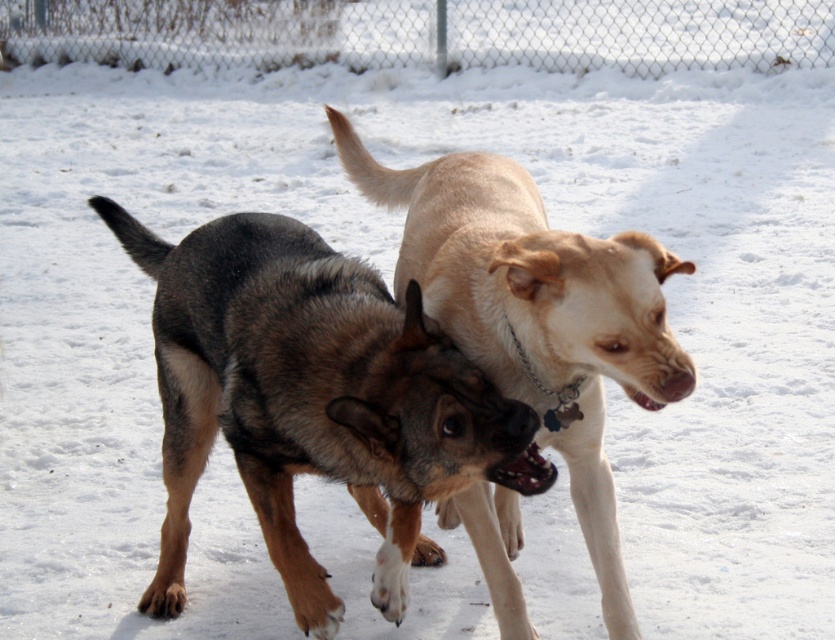
Does light brown fur dog at center lie in front of chain-link fence at upper center?

Yes.

Can you confirm if light brown fur dog at center is shorter than chain-link fence at upper center?

No, light brown fur dog at center is not shorter than chain-link fence at upper center.

Measure the distance between light brown fur dog at center and camera.

3.01 meters

At what (x,y) coordinates should I click in order to perform the action: click on light brown fur dog at center. Please return your answer as a coordinate pair (x, y). The image size is (835, 640). Looking at the image, I should click on (537, 314).

Which is behind, point (228, 317) or point (605, 467)?

Positioned behind is point (605, 467).

Is brown fur dog at center shorter than light brown fur dog at center?

Indeed, brown fur dog at center has a lesser height compared to light brown fur dog at center.

Where is `brown fur dog at center`? The image size is (835, 640). brown fur dog at center is located at coordinates (311, 397).

Between point (208, 378) and point (775, 36), which one is positioned in front?

Point (208, 378)

Between point (501, 460) and point (783, 61), which one is positioned behind?

The point (783, 61) is more distant.

Which is behind, point (334, 300) or point (453, 16)?

The point (453, 16) is behind.

At what (x,y) coordinates should I click in order to perform the action: click on brown fur dog at center. Please return your answer as a coordinate pair (x, y). Looking at the image, I should click on (311, 397).